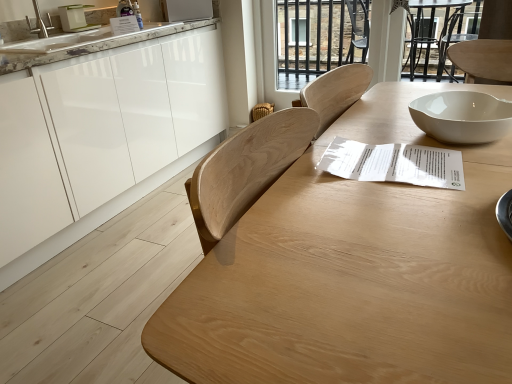
Question: Do you think woven straw chair at center is within transparent glass door at upper center, or outside of it?

Choices:
 (A) inside
 (B) outside

Answer: (B)

Question: Is woven straw chair at center in front of or behind transparent glass door at upper center in the image?

Choices:
 (A) behind
 (B) front

Answer: (A)

Question: Which object is positioned closest to the woven straw chair at center?

Choices:
 (A) white glossy microwave at upper center
 (B) transparent glass door at upper center
 (C) white glossy bowl at upper right
 (D) white glossy cabinets at left
 (E) white paper at center

Answer: (B)

Question: Estimate the real-world distances between objects in this image. Which object is farther from the white marble countertop at upper left?

Choices:
 (A) white glossy microwave at upper center
 (B) natural wood table at center
 (C) white glossy cabinets at left
 (D) white paper at center
 (E) woven straw chair at center

Answer: (B)